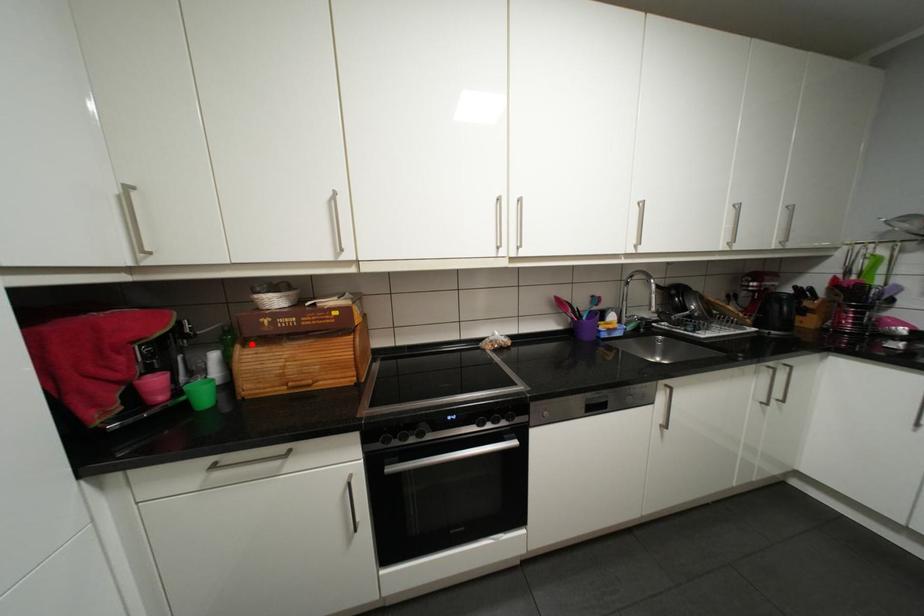
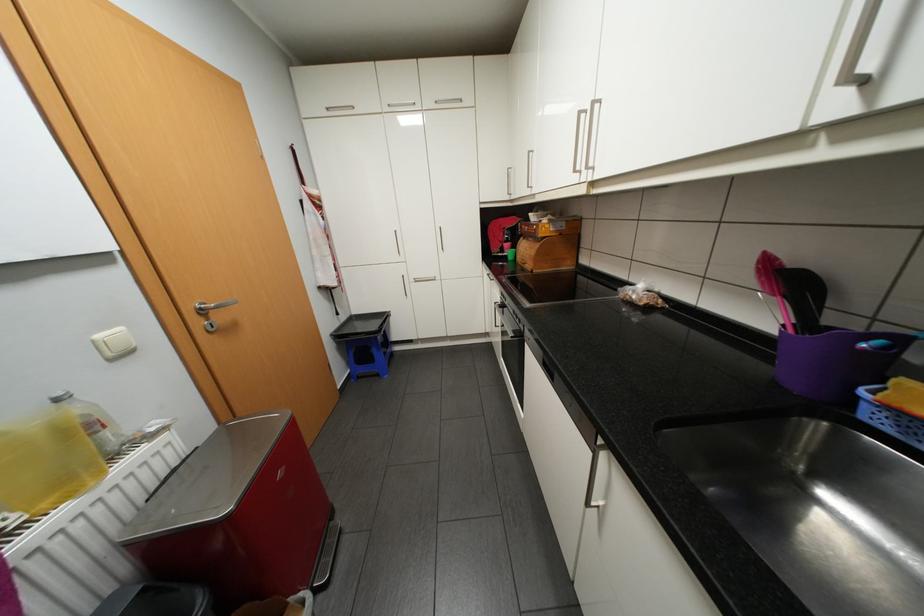
Question: A red point is marked in image1. In image2, is the corresponding 3D point closer to the camera or farther? Reply with the corresponding letter.

Choices:
 (A) The corresponding 3D point is closer.
 (B) The corresponding 3D point is farther.

Answer: (A)